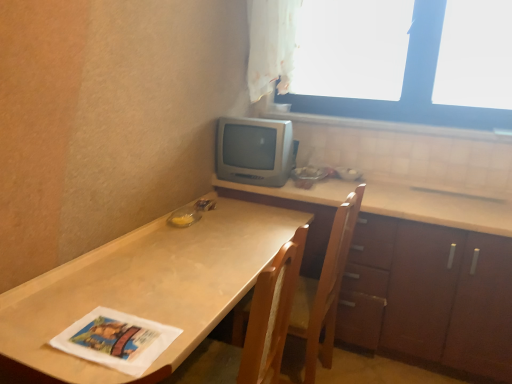
Image resolution: width=512 pixels, height=384 pixels. What are the coordinates of `vacant area on top of white paper magazine at lower left (from a real-world perspective)` in the screenshot? It's located at (118, 336).